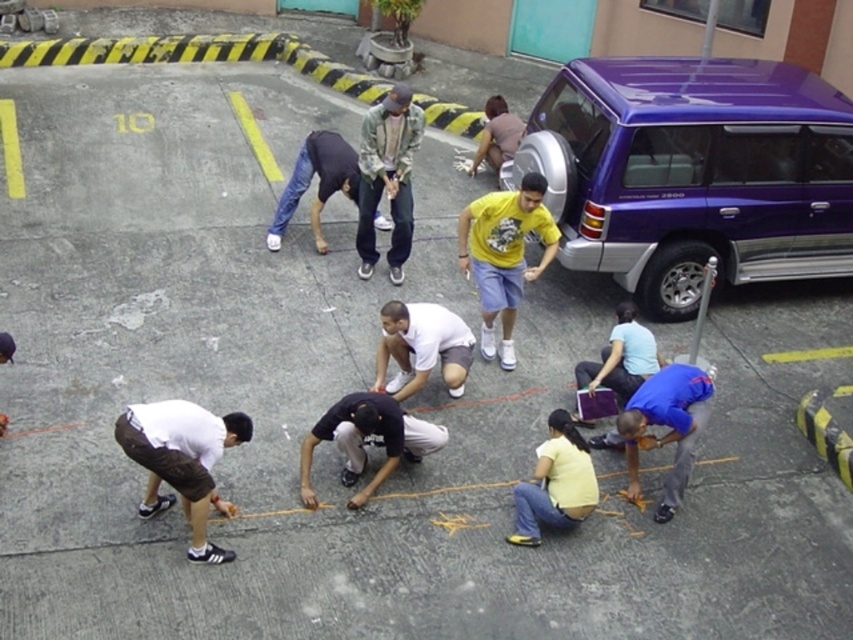
Question: Which object is farther from the camera taking this photo?

Choices:
 (A) metallic purple minivan at right
 (B) light blue shirt at center

Answer: (A)

Question: Is yellow matte shirt at center in front of white matte shirt at center?

Choices:
 (A) no
 (B) yes

Answer: (A)

Question: Which of the following is the farthest from the observer?

Choices:
 (A) (619, 316)
 (B) (445, 381)
 (C) (271, 225)

Answer: (C)

Question: Based on their relative distances, which object is nearer to the denim jacket at center?

Choices:
 (A) metallic purple minivan at right
 (B) white matte shorts at lower left

Answer: (A)

Question: Is yellow matte shirt at lower center closer to camera compared to brown cotton shirt at center?

Choices:
 (A) no
 (B) yes

Answer: (B)

Question: Does white matte shorts at lower left appear over denim jacket at center?

Choices:
 (A) no
 (B) yes

Answer: (A)